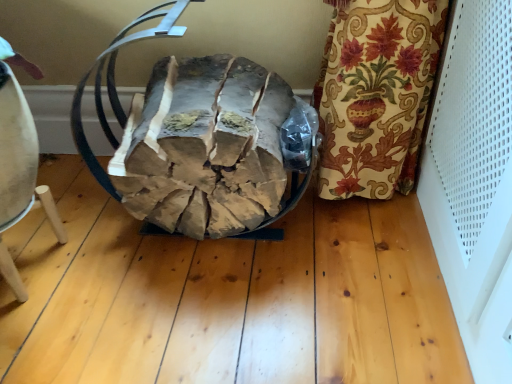
Question: Looking at the image, does light brown wooden stool at lower left seem bigger or smaller compared to brown leather bean bag chair at center?

Choices:
 (A) small
 (B) big

Answer: (A)

Question: From a real-world perspective, is light brown wooden stool at lower left physically located above or below brown leather bean bag chair at center?

Choices:
 (A) above
 (B) below

Answer: (B)

Question: Considering the positions of light brown wooden stool at lower left and brown leather bean bag chair at center in the image, is light brown wooden stool at lower left wider or thinner than brown leather bean bag chair at center?

Choices:
 (A) thin
 (B) wide

Answer: (A)

Question: Visually, is brown leather bean bag chair at center positioned to the left or to the right of light brown wooden stool at lower left?

Choices:
 (A) right
 (B) left

Answer: (A)

Question: In terms of height, does brown leather bean bag chair at center look taller or shorter compared to light brown wooden stool at lower left?

Choices:
 (A) short
 (B) tall

Answer: (B)

Question: Relative to light brown wooden stool at lower left, is brown leather bean bag chair at center in front or behind?

Choices:
 (A) front
 (B) behind

Answer: (A)

Question: Is point (217, 76) closer or farther from the camera than point (16, 278)?

Choices:
 (A) farther
 (B) closer

Answer: (A)